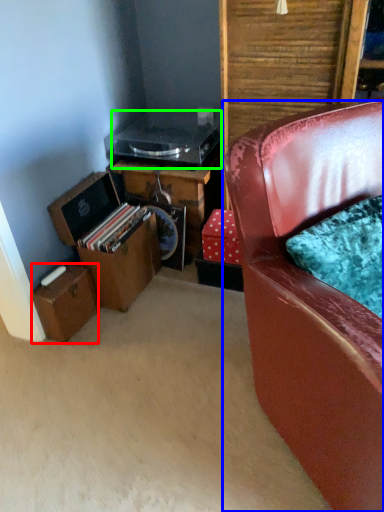
Question: Which is nearer to the box (highlighted by a red box)? chair (highlighted by a blue box) or appliance (highlighted by a green box).

Choices:
 (A) chair
 (B) appliance

Answer: (B)